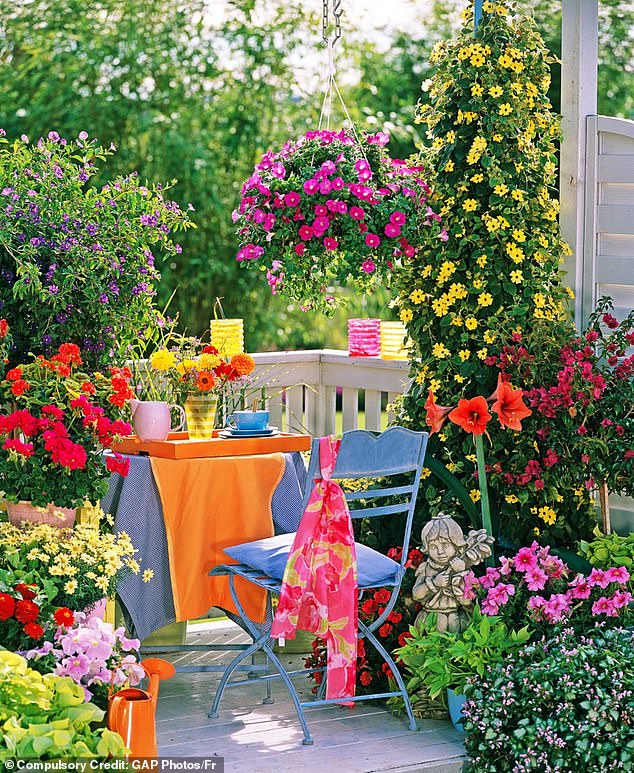
Locate an element on the screen. chair is located at coordinates (387, 458).